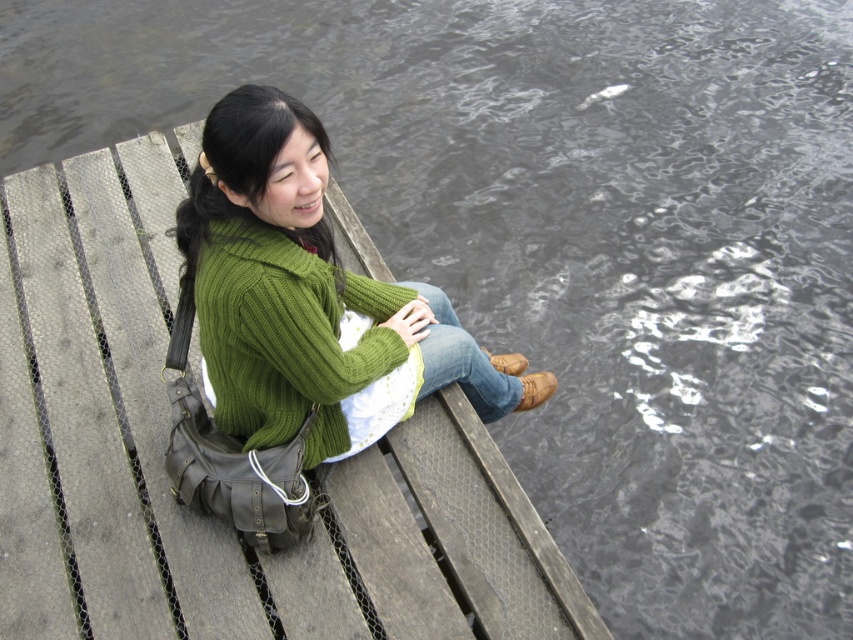
Question: Estimate the real-world distances between objects in this image. Which object is farther from the green knitted sweater at upper left?

Choices:
 (A) wooden dock at center
 (B) green knitted sweater at center

Answer: (A)

Question: Is wooden dock at center closer to camera compared to green knitted sweater at center?

Choices:
 (A) no
 (B) yes

Answer: (A)

Question: Can you confirm if green knitted sweater at center is smaller than green knitted sweater at upper left?

Choices:
 (A) yes
 (B) no

Answer: (B)

Question: Which of the following is the farthest from the observer?

Choices:
 (A) (294, 106)
 (B) (338, 435)

Answer: (B)

Question: Can you confirm if wooden dock at center is smaller than green knitted sweater at upper left?

Choices:
 (A) yes
 (B) no

Answer: (B)

Question: Among these points, which one is nearest to the camera?

Choices:
 (A) (245, 566)
 (B) (306, 152)

Answer: (B)